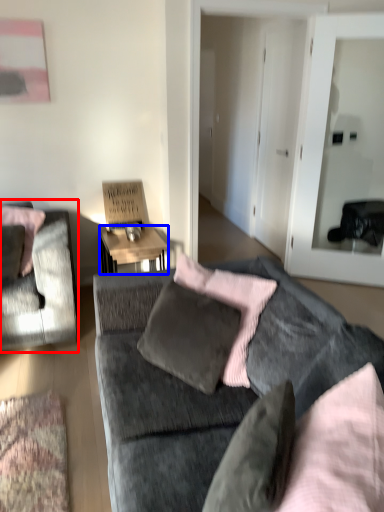
Question: Which object is further to the camera taking this photo, chair (highlighted by a red box) or desk (highlighted by a blue box)?

Choices:
 (A) chair
 (B) desk

Answer: (B)